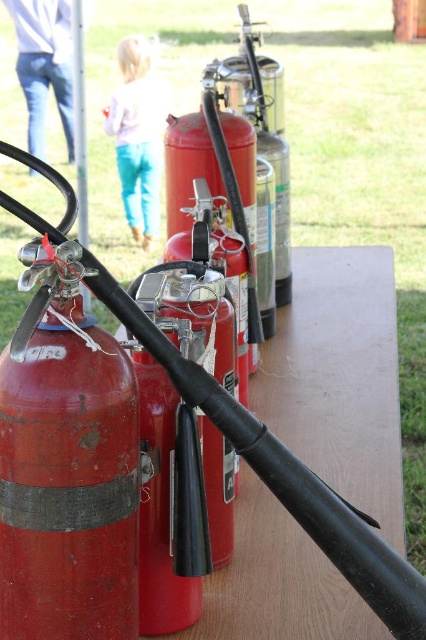
Looking at this image, who is more distant from viewer, [60,397] or [158,154]?

The point [158,154] is more distant.

Which of these two, matte red fire extinguisher at left or light blue jeans at upper center, stands taller?

Standing taller between the two is light blue jeans at upper center.

I want to click on matte red fire extinguisher at left, so click(x=66, y=468).

At what (x,y) coordinates should I click in order to perform the action: click on matte red fire extinguisher at left. Please return your answer as a coordinate pair (x, y). Image resolution: width=426 pixels, height=640 pixels. Looking at the image, I should click on (66, 468).